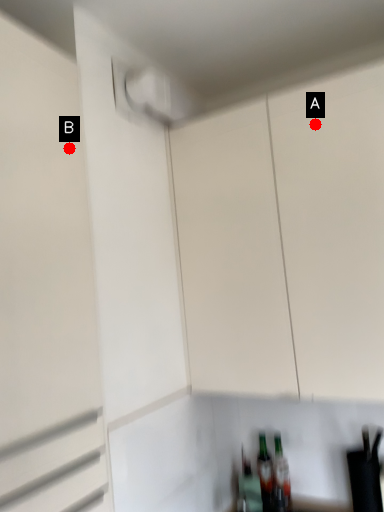
Question: Two points are circled on the image, labeled by A and B beside each circle. Which of the following is the closest to the observer?

Choices:
 (A) A is closer
 (B) B is closer

Answer: (B)